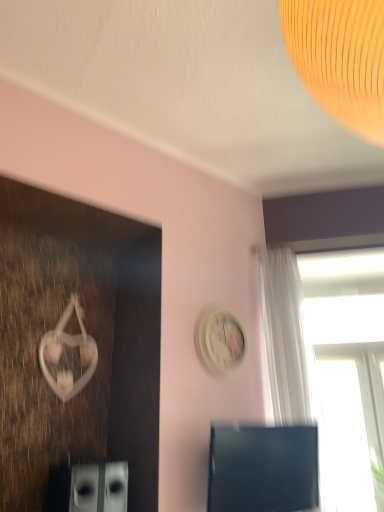
Question: Is black glossy computer monitor at lower right positioned in front of white glossy clock at upper center?

Choices:
 (A) no
 (B) yes

Answer: (B)

Question: From the image's perspective, does black glossy computer monitor at lower right appear higher than white glossy clock at upper center?

Choices:
 (A) yes
 (B) no

Answer: (B)

Question: Does black glossy computer monitor at lower right touch white glossy clock at upper center?

Choices:
 (A) no
 (B) yes

Answer: (A)

Question: From a real-world perspective, is black glossy computer monitor at lower right located higher than white glossy clock at upper center?

Choices:
 (A) yes
 (B) no

Answer: (B)

Question: Can you confirm if black glossy computer monitor at lower right is thinner than white glossy clock at upper center?

Choices:
 (A) no
 (B) yes

Answer: (A)

Question: Does point (311, 464) appear closer or farther from the camera than point (233, 365)?

Choices:
 (A) closer
 (B) farther

Answer: (A)

Question: From their relative heights in the image, would you say black glossy computer monitor at lower right is taller or shorter than white glossy clock at upper center?

Choices:
 (A) tall
 (B) short

Answer: (A)

Question: Is black glossy computer monitor at lower right to the left or to the right of white glossy clock at upper center in the image?

Choices:
 (A) right
 (B) left

Answer: (A)

Question: From a real-world perspective, is black glossy computer monitor at lower right physically located above or below white glossy clock at upper center?

Choices:
 (A) above
 (B) below

Answer: (B)

Question: From a real-world perspective, is black glossy computer monitor at lower right above or below transparent glass window at upper right?

Choices:
 (A) above
 (B) below

Answer: (B)

Question: Relative to transparent glass window at upper right, is black glossy computer monitor at lower right in front or behind?

Choices:
 (A) front
 (B) behind

Answer: (A)

Question: Considering the positions of point (218, 498) and point (344, 366), is point (218, 498) closer or farther from the camera than point (344, 366)?

Choices:
 (A) farther
 (B) closer

Answer: (B)

Question: From the image's perspective, is black glossy computer monitor at lower right above or below transparent glass window at upper right?

Choices:
 (A) above
 (B) below

Answer: (B)

Question: From the image's perspective, is transparent glass window at upper right above or below black glossy computer monitor at lower right?

Choices:
 (A) above
 (B) below

Answer: (A)

Question: From their relative heights in the image, would you say transparent glass window at upper right is taller or shorter than black glossy computer monitor at lower right?

Choices:
 (A) tall
 (B) short

Answer: (A)